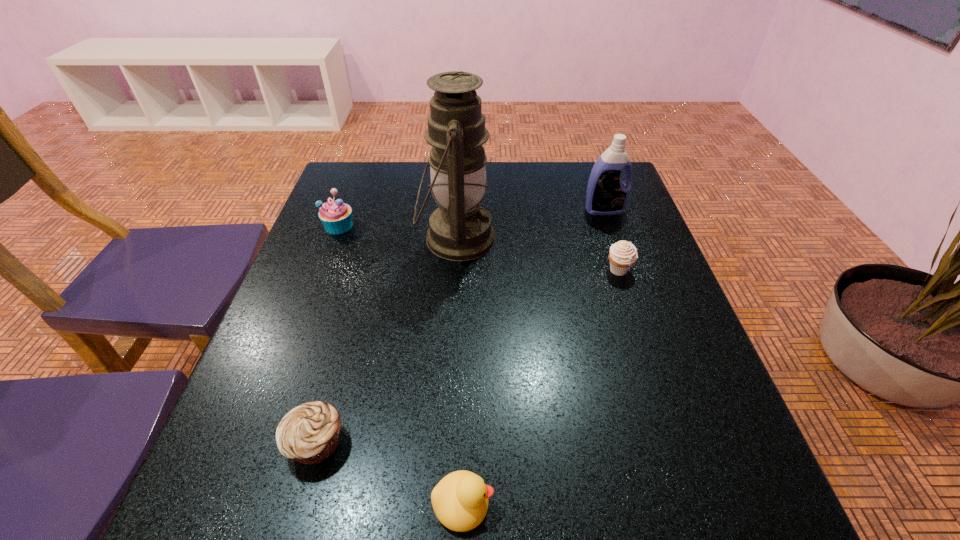
Where is `vacant space that satisfies the following two spatial constraints: 1. on the back side of the nearest muffin; 2. on the right side of the detergent`? vacant space that satisfies the following two spatial constraints: 1. on the back side of the nearest muffin; 2. on the right side of the detergent is located at coordinates (380, 210).

Locate an element on the screen. vacant space that satisfies the following two spatial constraints: 1. on the front side of the farthest muffin; 2. on the left side of the second nearest object is located at coordinates (257, 443).

At what (x,y) coordinates should I click in order to perform the action: click on free spot that satisfies the following two spatial constraints: 1. on the front side of the rightmost muffin; 2. on the face of the duckling. Please return your answer as a coordinate pair (x, y). This screenshot has width=960, height=540. Looking at the image, I should click on (696, 503).